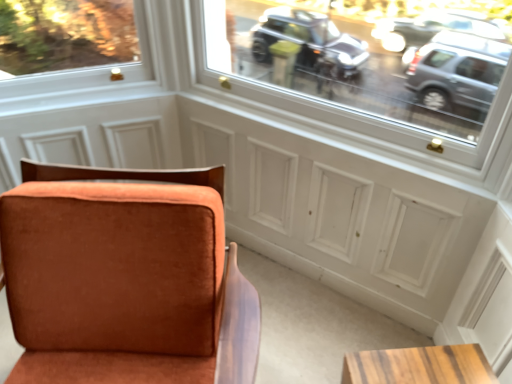
Describe the element at coordinates (122, 294) in the screenshot. I see `suede-like brown chair at center` at that location.

I want to click on suede-like brown chair at center, so 122,294.

Measure the distance between point (x=158, y=342) and camera.

A distance of 1.14 meters exists between point (x=158, y=342) and camera.

You are a GUI agent. You are given a task and a screenshot of the screen. Output one action in this format:
    pyautogui.click(x=<x>, y=<y>)
    Task: Click on the suede-like brown chair at center
    Image resolution: width=512 pixels, height=384 pixels.
    Given the screenshot: What is the action you would take?
    pyautogui.click(x=122, y=294)